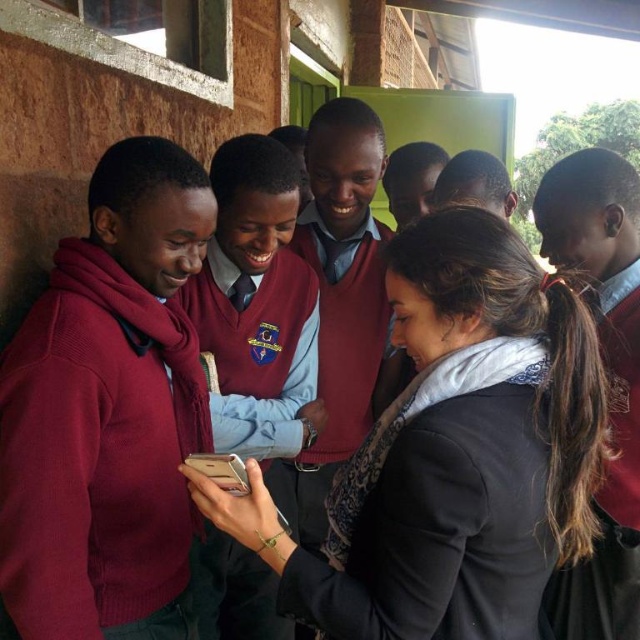
You are standing in a school courtyard and see two students wearing maroon sweater at left and black matte sweater at center. Which student is positioned more to the left side of the group?

The maroon sweater at left is positioned more to the left side of the group than the black matte sweater at center.

You are a photographer trying to capture a detailed shot of the smartphone held by the woman in the foreground. You notice two points of interest marked as point 1 and point 2 in the image. Point 1 is located at coordinates point (499, 420) and point 2 is at point (99, 545). Which point should you focus on to ensure the smartphone is in sharp focus?

You should focus on point (499, 420) because it is closer to the camera than point (99, 545), making it the optimal point for capturing the smartphone in sharp focus.